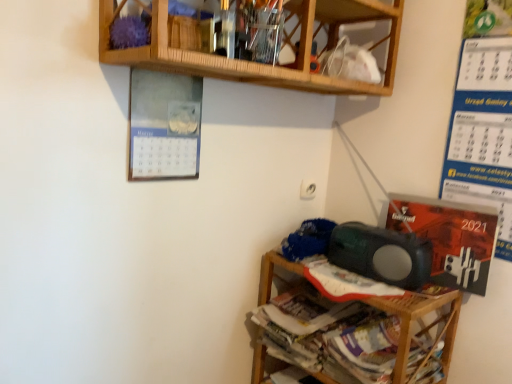
Where is `free point in front of orange glossy calendar at lower right, the 2th writing in the top-to-bottom sequence`? This screenshot has width=512, height=384. free point in front of orange glossy calendar at lower right, the 2th writing in the top-to-bottom sequence is located at coordinates (426, 295).